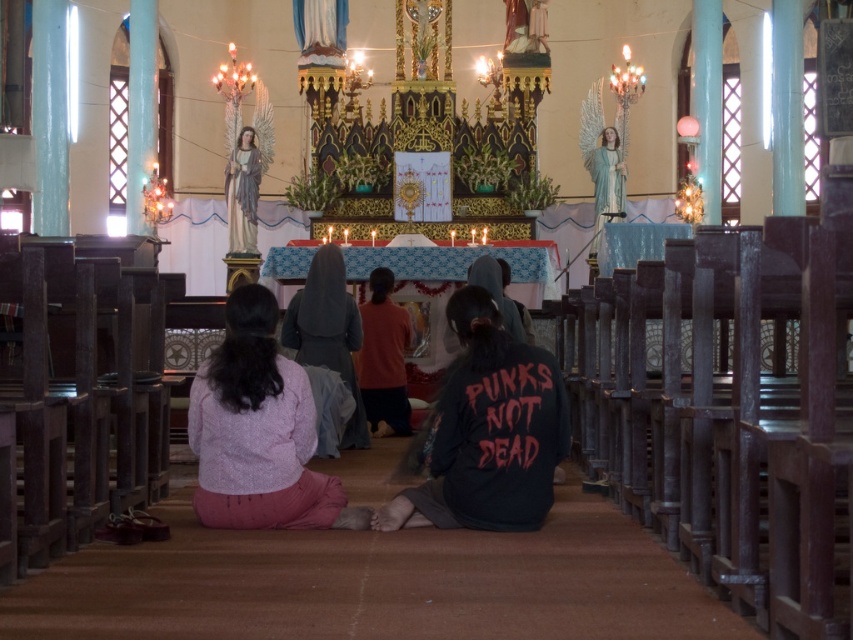
You are standing in the church and see the black matte sweatshirt at center and the dark gray fabric at center. Which item is closer to the ground?

The black matte sweatshirt at center is below dark gray fabric at center, so it is closer to the ground.

You are a photographer planning to capture a candid shot of the black matte sweatshirt at center and the pink fabric skirt at lower center. Since you want to ensure both subjects are in focus, you need to know which one is larger. Can you tell me which one is bigger?

The black matte sweatshirt at center is bigger than the pink fabric skirt at lower center, so you should focus on the larger one to ensure both are in focus.

In the scene shown: You are a photographer trying to capture the scene of the church altar. You notice the black matte sweatshirt at center and the dark gray fabric at center. Which one is closer to the camera lens?

The black matte sweatshirt at center is closer to the camera lens because it is in front of the dark gray fabric at center.